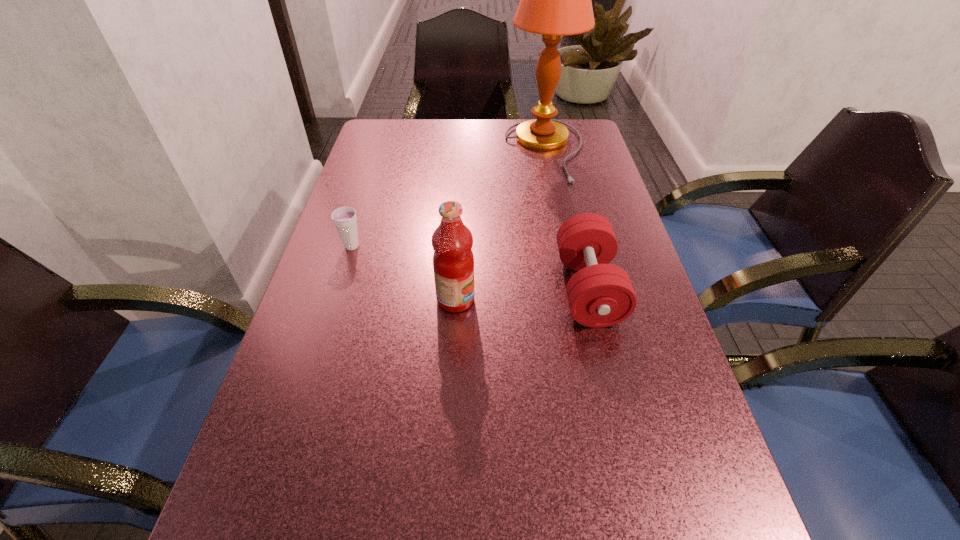
Locate an element on the screen. This screenshot has height=540, width=960. lamp is located at coordinates (555, 0).

At what (x,y) coordinates should I click in order to perform the action: click on the tallest object. Please return your answer as a coordinate pair (x, y). Looking at the image, I should click on (555, 0).

Where is `the third object from right to left`? The image size is (960, 540). the third object from right to left is located at coordinates (453, 261).

Where is `fruit juice`? fruit juice is located at coordinates point(453,261).

Where is `the third tallest object`? the third tallest object is located at coordinates (600, 294).

Identify the location of the leftmost object. (344, 218).

Locate an element on the screen. cup is located at coordinates (344, 218).

Locate an element on the screen. vacant area located 0.280m on the front of the lamp is located at coordinates (566, 251).

This screenshot has width=960, height=540. I want to click on free space located on the front label of the third shortest object, so click(x=623, y=300).

Locate an element on the screen. The image size is (960, 540). free space located on the front of the dumbbell is located at coordinates (623, 437).